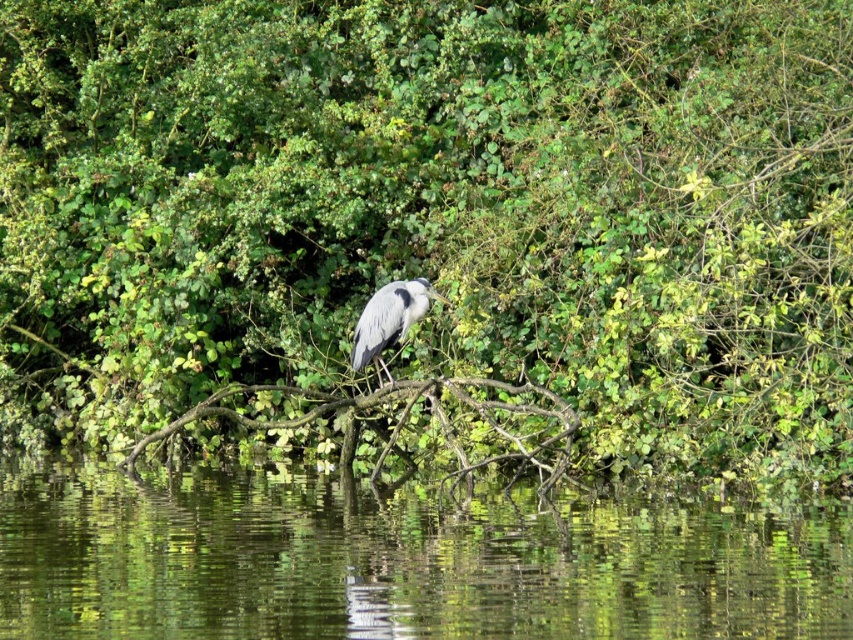
Question: Which object is farther from the camera taking this photo?

Choices:
 (A) transparent water at center
 (B) gray matte heron at center

Answer: (B)

Question: Where is transparent water at center located in relation to gray matte heron at center in the image?

Choices:
 (A) left
 (B) right

Answer: (A)

Question: Which of the following is the closest to the observer?

Choices:
 (A) brown rough tree branch at center
 (B) gray matte heron at center

Answer: (B)

Question: Does transparent water at center have a larger size compared to gray matte heron at center?

Choices:
 (A) no
 (B) yes

Answer: (B)

Question: Is transparent water at center thinner than brown rough tree branch at center?

Choices:
 (A) yes
 (B) no

Answer: (B)

Question: Which point is farther to the camera?

Choices:
 (A) coord(399,333)
 (B) coord(566,566)

Answer: (A)